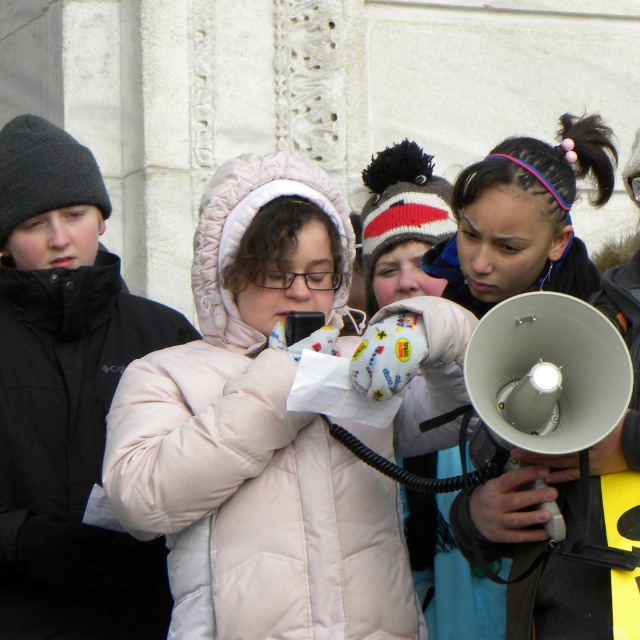
Between point (168, 516) and point (538, 218), which one is positioned in front?

Point (168, 516)

Between white puffy coat at center and matte gray megaphone at center, which one appears on the right side from the viewer's perspective?

matte gray megaphone at center is more to the right.

Is point (234, 406) less distant than point (570, 493)?

Yes, point (234, 406) is in front of point (570, 493).

Image resolution: width=640 pixels, height=640 pixels. In order to click on white puffy coat at center in this screenshot , I will do `click(259, 432)`.